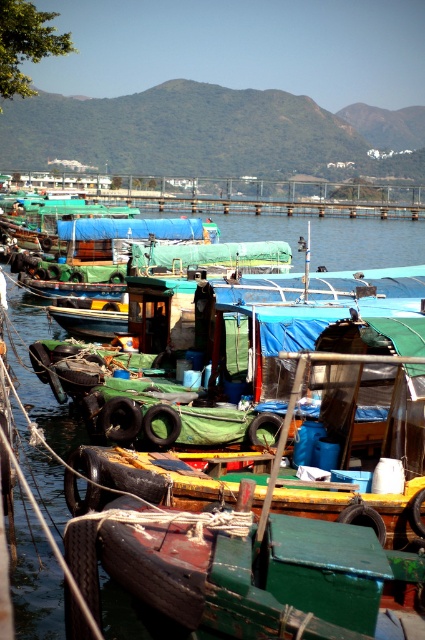
Based on the photo, you are standing on the pier and see the point marked as point (x=356, y=237). What is the nature of the object located at this point?

The point (x=356, y=237) corresponds to the transparent plastic water at center, which is a body of water likely part of the waterfront scene described.

You are a photographer trying to capture the green canvas boat at center in the image. Since the transparent plastic water at center is blocking your view, can you determine if you can move the water to get a clear shot of the boat?

The transparent plastic water at center is bigger than green canvas boat at center, so it might be difficult to move the water to get a clear shot of the boat.

You are a fisherman who wants to board the green canvas boat at center. However, there is transparent plastic water at center in your way. Can you step over it to reach the boat?

The transparent plastic water at center is positioned over green canvas boat at center, so you cannot step over it because the water is above the boat, making it impossible to access the boat from above.